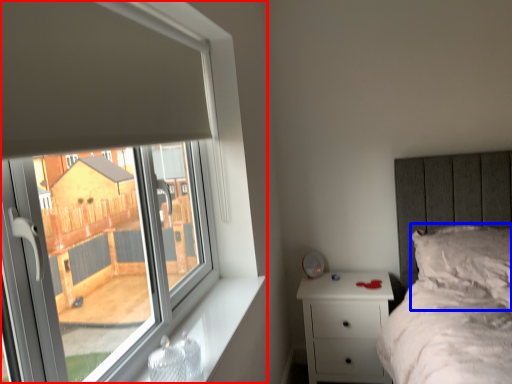
Question: Which of the following is the closest to the observer, window (highlighted by a red box) or pillow (highlighted by a blue box)?

Choices:
 (A) window
 (B) pillow

Answer: (A)